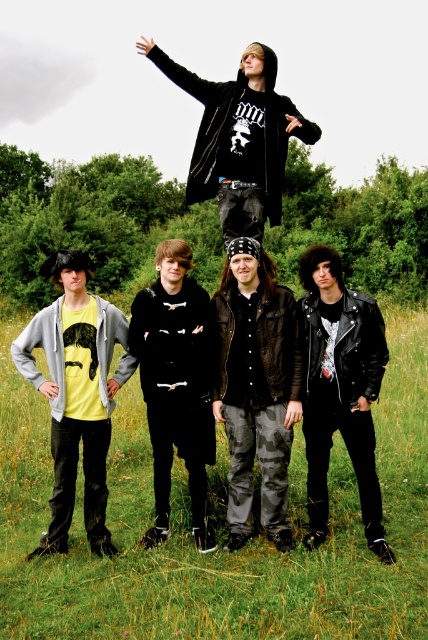
Question: Which of the following is the farthest from the observer?

Choices:
 (A) black leather jacket at upper center
 (B) black leather jacket at center
 (C) leather jacket at lower right
 (D) camouflage pants at center

Answer: (A)

Question: Does camouflage pants at center lie behind matte yellow t-shirt at left?

Choices:
 (A) yes
 (B) no

Answer: (A)

Question: Can you confirm if camouflage pants at center is bigger than black leather jacket at upper center?

Choices:
 (A) yes
 (B) no

Answer: (B)

Question: Does matte yellow t-shirt at left appear on the left side of leather jacket at lower right?

Choices:
 (A) no
 (B) yes

Answer: (B)

Question: Which point is farther to the camera?

Choices:
 (A) green grass at lower center
 (B) leather jacket at lower right

Answer: (B)

Question: Estimate the real-world distances between objects in this image. Which object is farther from the camouflage pants at center?

Choices:
 (A) black leather jacket at upper center
 (B) matte yellow t-shirt at left
 (C) green grass at lower center

Answer: (A)